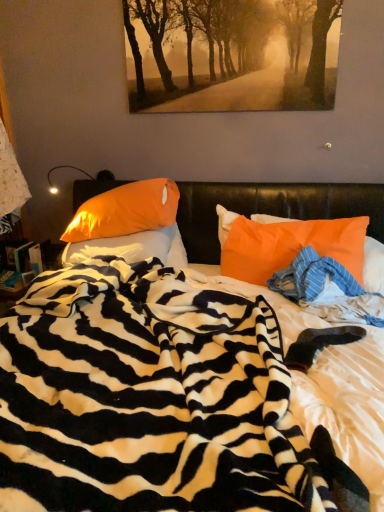
Question: Does point (192, 442) appear closer or farther from the camera than point (289, 285)?

Choices:
 (A) closer
 (B) farther

Answer: (A)

Question: In the image, is zebra-patterned blanket at center on the left side or the right side of blue striped fabric at center?

Choices:
 (A) right
 (B) left

Answer: (B)

Question: Considering the real-world distances, which object is farthest from the zebra-patterned blanket at center?

Choices:
 (A) orange fabric pillow at left, arranged as the 2th pillow when viewed from the left
 (B) orange satin pillow at center, which appears as the 3th pillow when viewed from the right
 (C) golden textured pathway at upper center
 (D) orange fabric pillow at right, acting as the 1th pillow starting from the right
 (E) blue striped fabric at center

Answer: (C)

Question: Considering the real-world distances, which object is closest to the orange satin pillow at center, arranged as the first pillow when viewed from the left?

Choices:
 (A) orange fabric pillow at left, positioned as the 2th pillow in right-to-left order
 (B) zebra-patterned blanket at center
 (C) orange fabric pillow at right, acting as the 1th pillow starting from the right
 (D) golden textured pathway at upper center
 (E) blue striped fabric at center

Answer: (A)